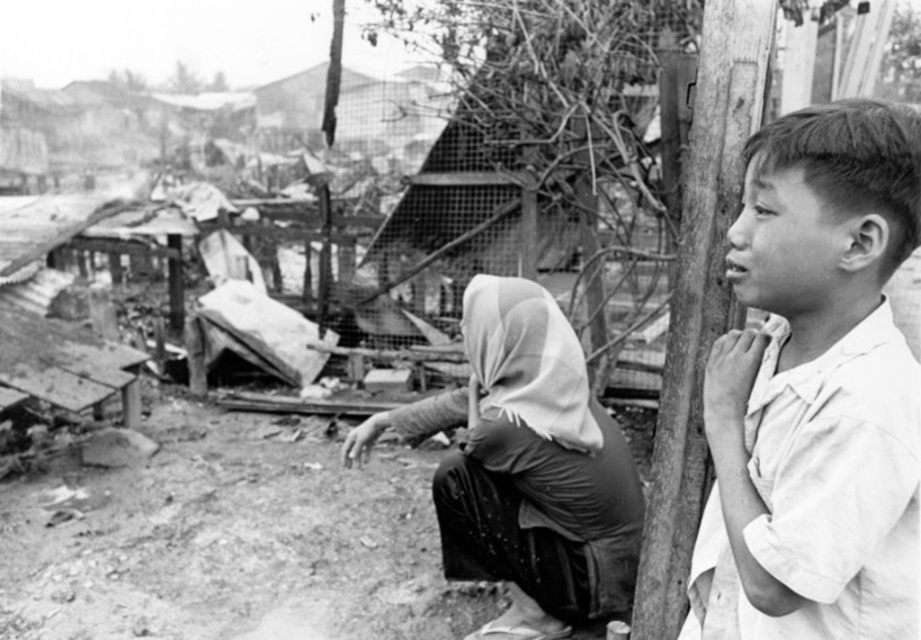
Between point (888, 515) and point (680, 474), which one is positioned in front?

Point (888, 515) is more forward.

The height and width of the screenshot is (640, 921). Identify the location of white cotton shirt at right. (815, 390).

What do you see at coordinates (815, 390) in the screenshot? The width and height of the screenshot is (921, 640). I see `white cotton shirt at right` at bounding box center [815, 390].

Locate an element on the screen. white cotton shirt at right is located at coordinates [815, 390].

Between point (622, 512) and point (640, 577), which one is positioned behind?

The point (622, 512) is behind.

Is white fabric headscarf at center thinner than smooth wood pole at right?

Incorrect, white fabric headscarf at center's width is not less than smooth wood pole at right's.

This screenshot has height=640, width=921. I want to click on white fabric headscarf at center, so click(528, 467).

You are a GUI agent. You are given a task and a screenshot of the screen. Output one action in this format:
    pyautogui.click(x=<x>, y=<y>)
    Task: Click on the white fabric headscarf at center
    Image resolution: width=921 pixels, height=640 pixels.
    Given the screenshot: What is the action you would take?
    pyautogui.click(x=528, y=467)

Does white cotton shirt at right appear under white fabric headscarf at center?

No, white cotton shirt at right is not below white fabric headscarf at center.

Find the location of a particular element. Image resolution: width=921 pixels, height=640 pixels. white cotton shirt at right is located at coordinates (815, 390).